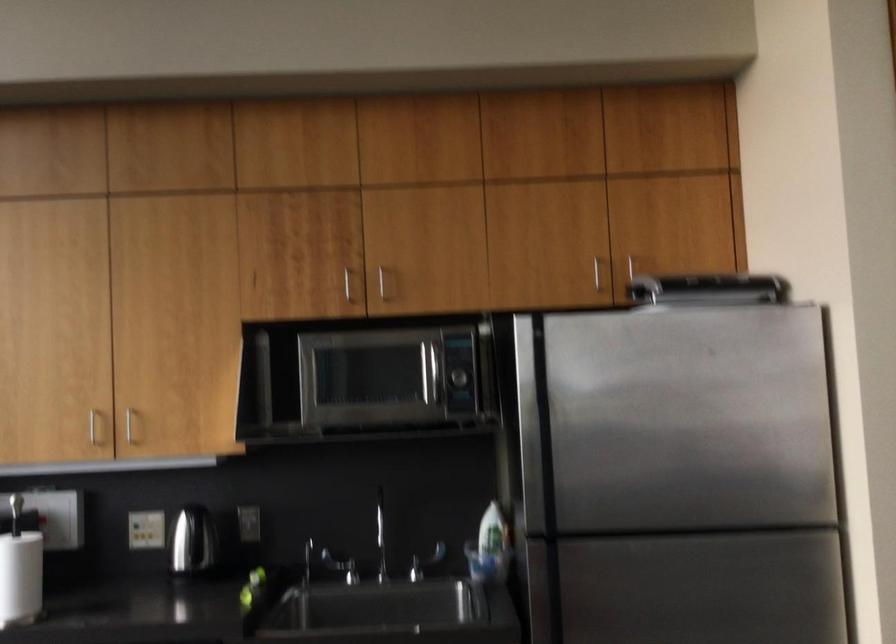
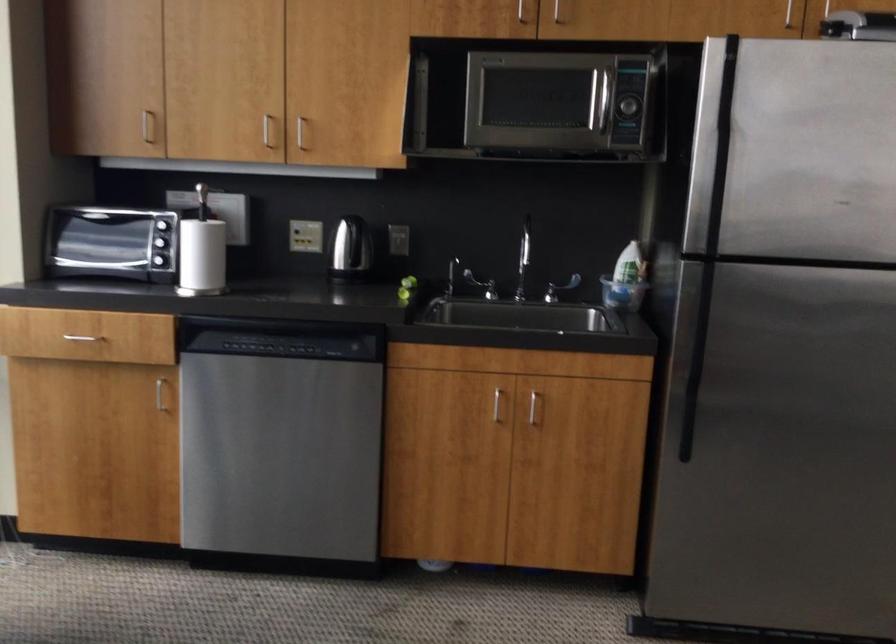
The point at (554, 451) is marked in the first image. Where is the corresponding point in the second image?

(718, 184)